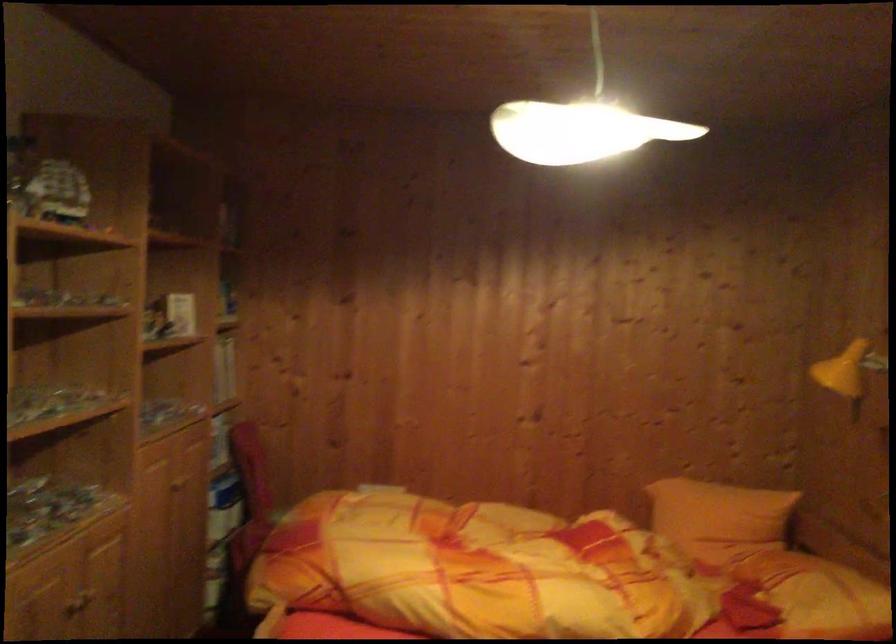
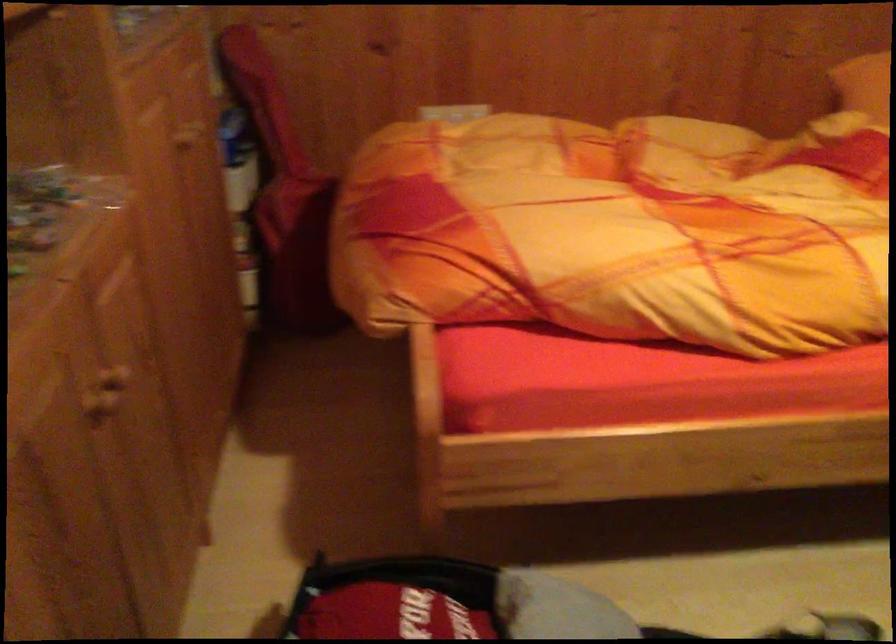
The images are taken continuously from a first-person perspective. In which direction are you moving?

The cameraman moved toward left, forward.